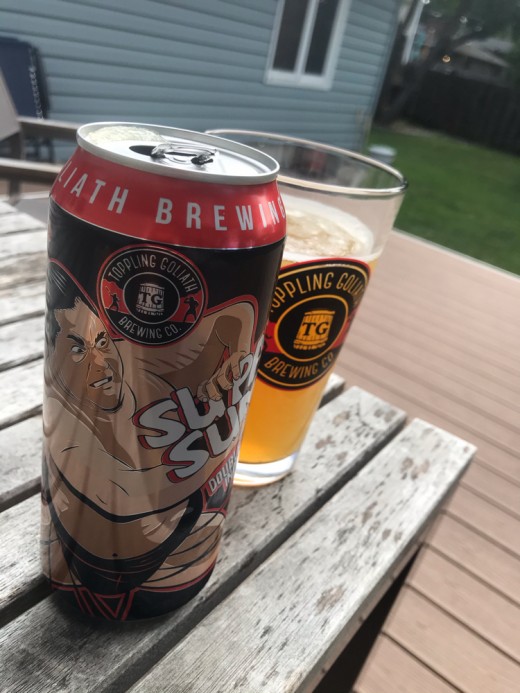
Identify the location of glass. This screenshot has width=520, height=693. (376, 216).